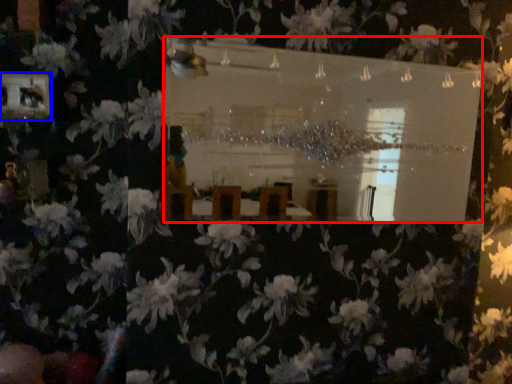
Question: Among these objects, which one is farthest to the camera, mirror (highlighted by a red box) or picture frame (highlighted by a blue box)?

Choices:
 (A) mirror
 (B) picture frame

Answer: (B)